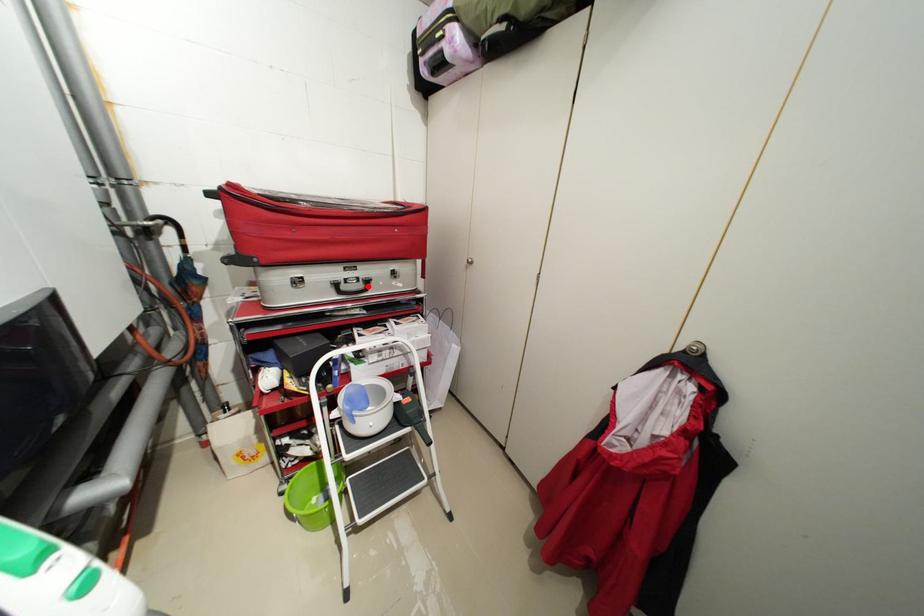
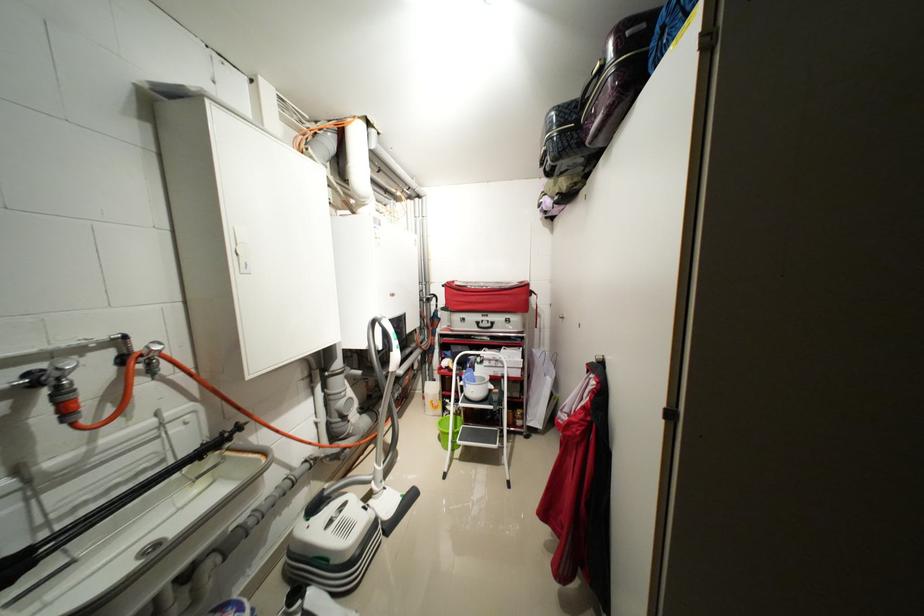
Find the pixel in the second image that matches the highlighted location in the first image.

(496, 326)